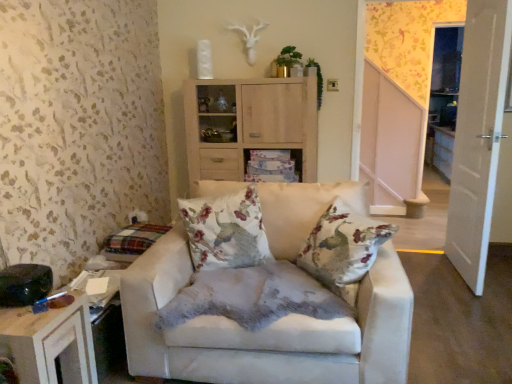
Question: Considering the relative sizes of white glossy cabinet at center and floral fabric cushion at center in the image provided, is white glossy cabinet at center wider than floral fabric cushion at center?

Choices:
 (A) yes
 (B) no

Answer: (A)

Question: From the image's perspective, is white glossy cabinet at center on floral fabric cushion at center?

Choices:
 (A) no
 (B) yes

Answer: (B)

Question: From the image's perspective, does white glossy cabinet at center appear lower than floral fabric cushion at center?

Choices:
 (A) no
 (B) yes

Answer: (A)

Question: Is white glossy cabinet at center at the left side of floral fabric cushion at center?

Choices:
 (A) yes
 (B) no

Answer: (B)

Question: Does white glossy cabinet at center lie behind floral fabric cushion at center?

Choices:
 (A) no
 (B) yes

Answer: (B)

Question: In the image, is wooden table at lower left on the left side or the right side of suede beige armchair at center?

Choices:
 (A) right
 (B) left

Answer: (B)

Question: Looking at their shapes, would you say wooden table at lower left is wider or thinner than suede beige armchair at center?

Choices:
 (A) wide
 (B) thin

Answer: (B)

Question: From a real-world perspective, is wooden table at lower left positioned above or below suede beige armchair at center?

Choices:
 (A) above
 (B) below

Answer: (B)

Question: From the image's perspective, is wooden table at lower left above or below suede beige armchair at center?

Choices:
 (A) below
 (B) above

Answer: (A)

Question: In terms of height, does floral fabric cushion at center look taller or shorter compared to suede beige armchair at center?

Choices:
 (A) short
 (B) tall

Answer: (A)

Question: From a real-world perspective, is floral fabric cushion at center positioned above or below suede beige armchair at center?

Choices:
 (A) above
 (B) below

Answer: (A)

Question: Looking at their shapes, would you say floral fabric cushion at center is wider or thinner than suede beige armchair at center?

Choices:
 (A) thin
 (B) wide

Answer: (A)

Question: Relative to suede beige armchair at center, is floral fabric cushion at center in front or behind?

Choices:
 (A) front
 (B) behind

Answer: (B)

Question: From a real-world perspective, relative to white glossy door at right, is floral fabric cushion at center vertically above or below?

Choices:
 (A) below
 (B) above

Answer: (A)

Question: Looking at the image, does floral fabric cushion at center seem bigger or smaller compared to white glossy door at right?

Choices:
 (A) small
 (B) big

Answer: (A)